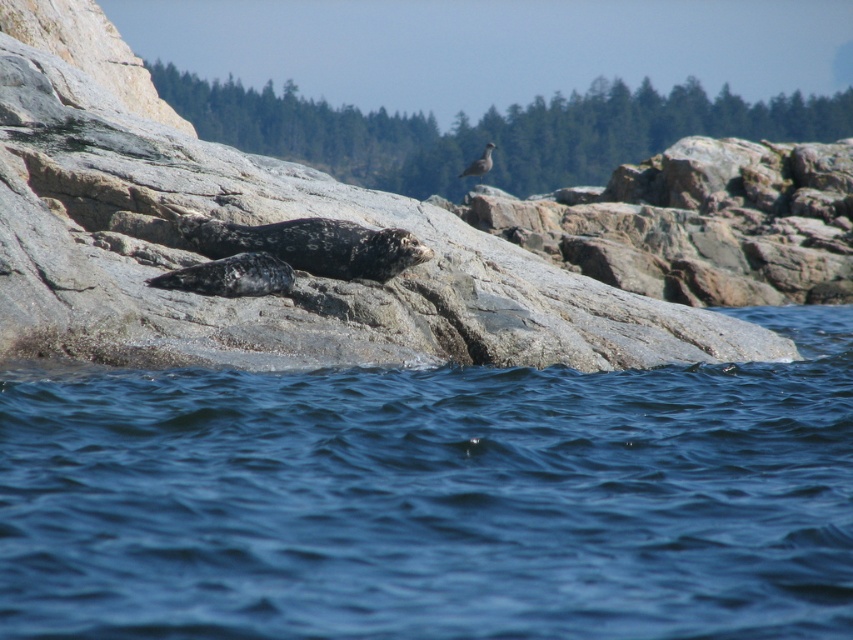
Question: Is smooth gray rock at center thinner than gray feathered bird at upper center?

Choices:
 (A) no
 (B) yes

Answer: (A)

Question: Which point is farther from the camera taking this photo?

Choices:
 (A) (74, 168)
 (B) (489, 156)

Answer: (B)

Question: Can you confirm if blue water at lower center is positioned below smooth gray rock at center?

Choices:
 (A) yes
 (B) no

Answer: (A)

Question: Is smooth gray rock at center to the left of gray feathered bird at upper center from the viewer's perspective?

Choices:
 (A) no
 (B) yes

Answer: (A)

Question: Which point is closer to the camera taking this photo?

Choices:
 (A) (152, 435)
 (B) (489, 164)

Answer: (A)

Question: Which object is closer to the camera taking this photo?

Choices:
 (A) gray feathered bird at upper center
 (B) smooth gray rock at center
 (C) blue water at lower center

Answer: (C)